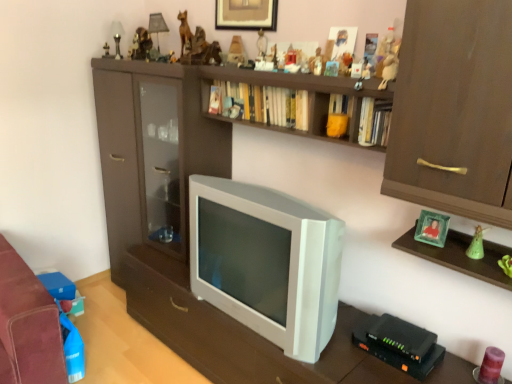
Question: In terms of height, does matte brown figurine at upper center, the fifth toy positioned from the bottom, look taller or shorter compared to green glass photo frame at upper right?

Choices:
 (A) tall
 (B) short

Answer: (B)

Question: Choose the correct answer: Is matte brown figurine at upper center, the fifth toy positioned from the bottom, inside green glass photo frame at upper right or outside it?

Choices:
 (A) outside
 (B) inside

Answer: (A)

Question: Based on their relative distances, which object is nearer to the metallic gold statue at upper center, marked as the eleventh toy in a front-to-back arrangement?

Choices:
 (A) matte brown figurine at upper center, placed as the seventh toy when sorted from left to right
 (B) green matte figurine at right, the tenth toy when ordered from left to right
 (C) matte brown shelf at center
 (D) translucent purple candle at lower right, the 11th toy in the top-to-bottom sequence
 (E) hardcover book at upper center, which is counted as the 1th book, starting from the left

Answer: (C)

Question: Which object is positioned farthest from the matte brown shelf at center?

Choices:
 (A) matte plastic toy at upper center, which is the fourth toy from bottom to top
 (B) white plastic television at center
 (C) green matte figurine at right, which appears as the 2th toy when viewed from the right
 (D) yellow matte bookshelf at upper center, marked as the second book in a front-to-back arrangement
 (E) matte brown statue at upper center, acting as the second toy starting from the back

Answer: (C)